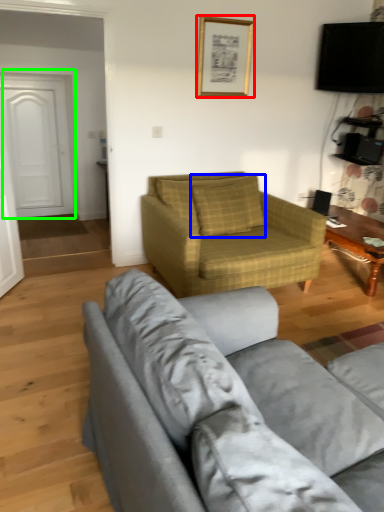
Question: Based on their relative distances, which object is farther from picture frame (highlighted by a red box)? Choose from pillow (highlighted by a blue box) and door (highlighted by a green box).

Choices:
 (A) pillow
 (B) door

Answer: (B)